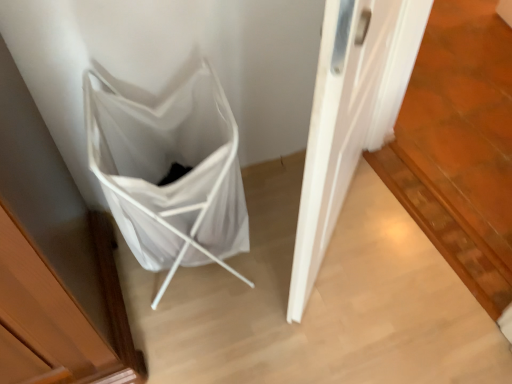
Find the location of `vacant area that lies to the right of white matte door at center`. vacant area that lies to the right of white matte door at center is located at coordinates (397, 243).